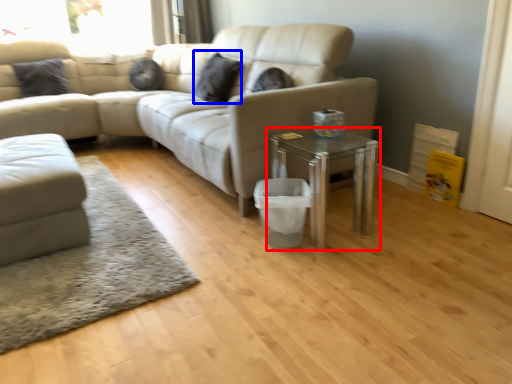
Question: Which object appears closest to the camera in this image, table (highlighted by a red box) or pillow (highlighted by a blue box)?

Choices:
 (A) table
 (B) pillow

Answer: (A)